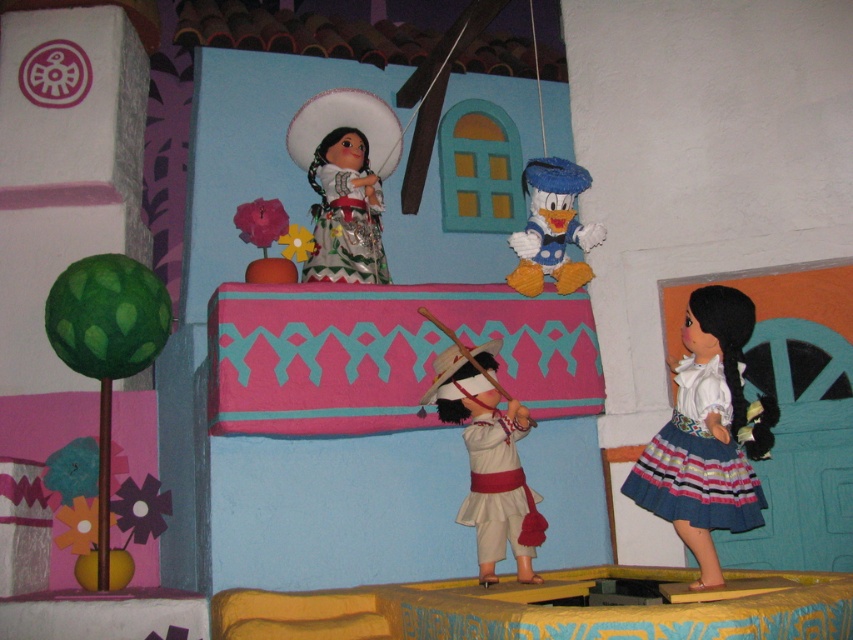
From the picture: Does striped cotton skirt at lower right appear under matte yellow plush duck at center?

Yes, striped cotton skirt at lower right is below matte yellow plush duck at center.

Does point (717, 451) come in front of point (579, 234)?

Yes, point (717, 451) is in front of point (579, 234).

You are a GUI agent. You are given a task and a screenshot of the screen. Output one action in this format:
    pyautogui.click(x=<x>, y=<y>)
    Task: Click on the striped cotton skirt at lower right
    
    Given the screenshot: What is the action you would take?
    pyautogui.click(x=697, y=461)

Where is `striped cotton skirt at lower right`? striped cotton skirt at lower right is located at coordinates (697, 461).

Based on the photo, between matte white doll at upper center and striped cotton skirt at lower right, which one is positioned higher?

Positioned higher is matte white doll at upper center.

Does matte white doll at upper center appear under striped cotton skirt at lower right?

No, matte white doll at upper center is not below striped cotton skirt at lower right.

Who is more forward, [369,260] or [671,426]?

Positioned in front is point [671,426].

I want to click on matte white doll at upper center, so click(x=345, y=180).

Can you confirm if white cotton dress at center is positioned above matte yellow plush duck at center?

No, white cotton dress at center is not above matte yellow plush duck at center.

Is white cotton dress at center shorter than matte yellow plush duck at center?

Yes.

This screenshot has height=640, width=853. What are the coordinates of `white cotton dress at center` in the screenshot? It's located at (497, 490).